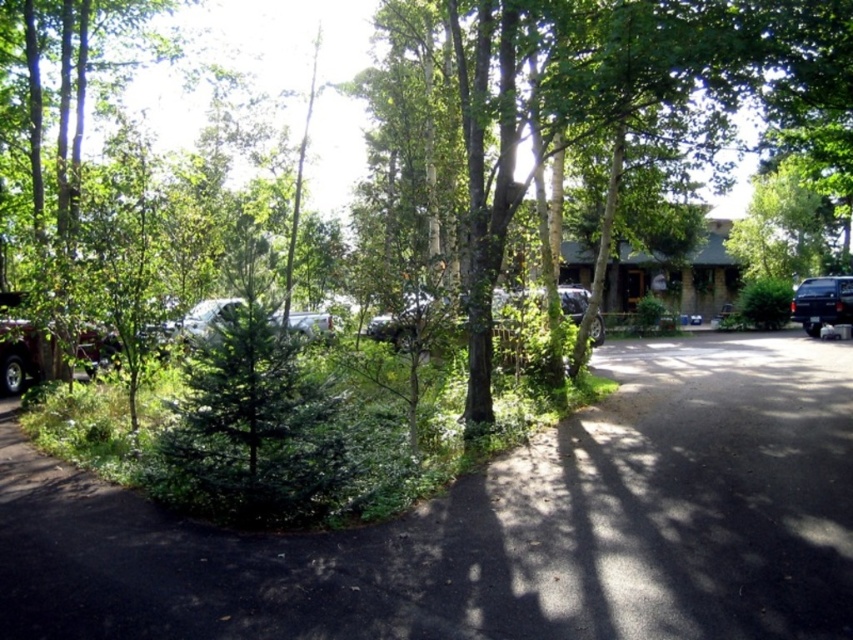
Question: Which of the following is the farthest from the observer?

Choices:
 (A) (560, 456)
 (B) (219, 304)

Answer: (B)

Question: Can you confirm if dark asphalt driveway at lower center is positioned below black matte truck at right?

Choices:
 (A) no
 (B) yes

Answer: (B)

Question: Considering the relative positions of metallic silver truck at center and black matte truck at right in the image provided, where is metallic silver truck at center located with respect to black matte truck at right?

Choices:
 (A) below
 (B) above

Answer: (A)

Question: Does dark asphalt driveway at lower center appear under black matte truck at right?

Choices:
 (A) no
 (B) yes

Answer: (B)

Question: Which object appears farthest from the camera in this image?

Choices:
 (A) dark asphalt driveway at lower center
 (B) black matte truck at right
 (C) metallic silver truck at center

Answer: (B)

Question: Which of the following is the farthest from the observer?

Choices:
 (A) (314, 323)
 (B) (683, 378)
 (C) (827, 285)

Answer: (C)